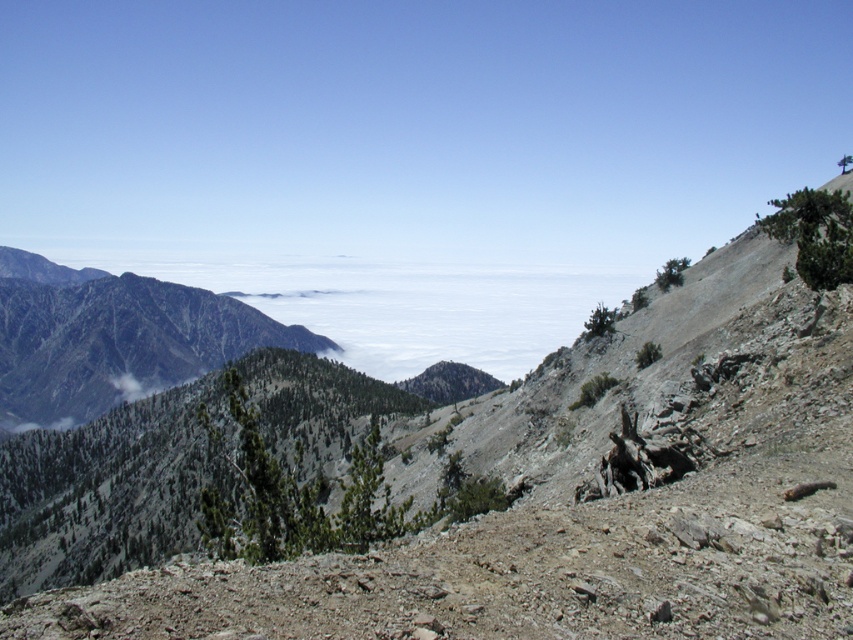
Question: Among these objects, which one is nearest to the camera?

Choices:
 (A) dull gray rock at center
 (B) green textured mountain at left

Answer: (A)

Question: Which point is farther to the camera?

Choices:
 (A) green textured mountain at left
 (B) dull gray rock at center

Answer: (A)

Question: Which point is farther to the camera?

Choices:
 (A) green textured mountain at left
 (B) dull gray rock at center

Answer: (A)

Question: Does dull gray rock at center appear on the left side of green textured mountain at left?

Choices:
 (A) yes
 (B) no

Answer: (B)

Question: Is dull gray rock at center to the left of green textured mountain at left from the viewer's perspective?

Choices:
 (A) no
 (B) yes

Answer: (A)

Question: Is dull gray rock at center above green textured mountain at left?

Choices:
 (A) yes
 (B) no

Answer: (B)